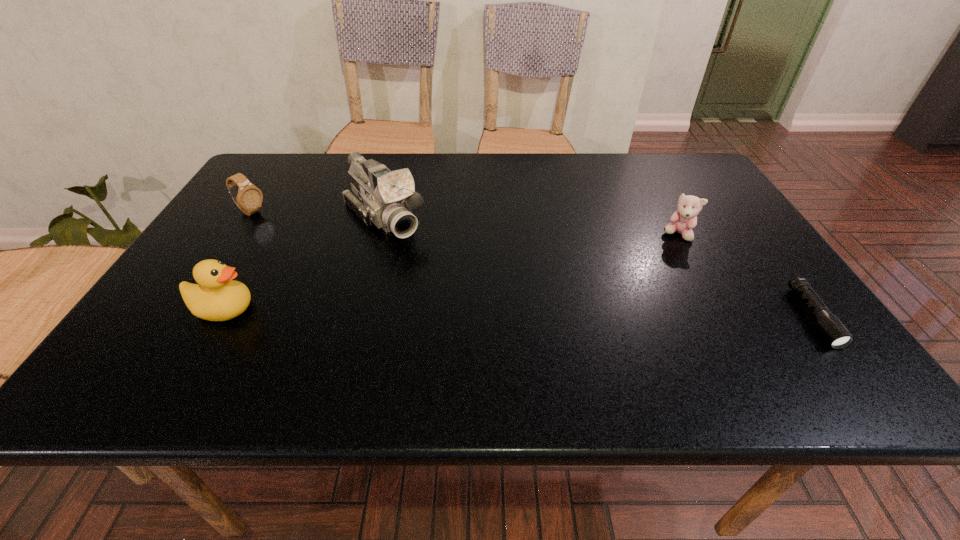
You are a GUI agent. You are given a task and a screenshot of the screen. Output one action in this format:
    pyautogui.click(x=<x>, y=<y>)
    Task: Click on the free space on the desktop that is between the fourth shortest object and the rightmost object and is positioned on the face of the watch
    
    Given the screenshot: What is the action you would take?
    pyautogui.click(x=439, y=313)

At what (x,y) coordinates should I click in order to perform the action: click on free spot on the desktop that is between the duck and the rightmost object and is positioned at the face of the teddy bear. Please return your answer as a coordinate pair (x, y). This screenshot has width=960, height=540. Looking at the image, I should click on (568, 314).

Where is `vacant spot on the desktop that is between the duck and the flashlight and is positioned on the front-facing side of the camcorder`? vacant spot on the desktop that is between the duck and the flashlight and is positioned on the front-facing side of the camcorder is located at coordinates pos(476,313).